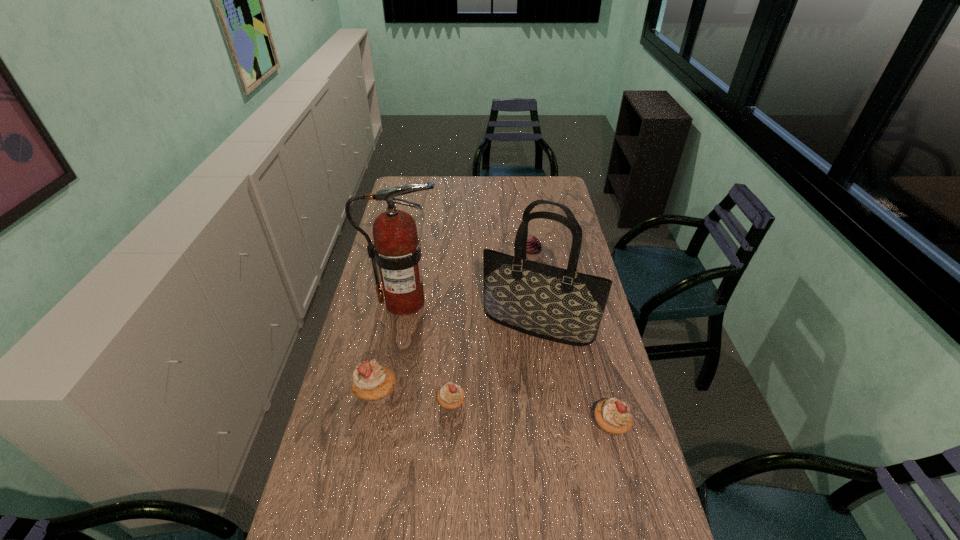
Identify the location of free spot at the left edge of the desktop. (375, 305).

Find the location of a particular element. Image resolution: width=960 pixels, height=540 pixels. free space at the right edge is located at coordinates (627, 443).

Find the location of a particular element. The image size is (960, 540). vacant space at the far left corner of the desktop is located at coordinates (425, 177).

In order to click on vacant space at the near right corner of the desktop in this screenshot , I will do `click(647, 514)`.

The width and height of the screenshot is (960, 540). I want to click on vacant area between the third cupcake from right to left and the fire extinguisher, so click(x=428, y=353).

Image resolution: width=960 pixels, height=540 pixels. In order to click on free space between the fire extinguisher and the fourth object from right to left in this screenshot , I will do `click(428, 353)`.

You are a GUI agent. You are given a task and a screenshot of the screen. Output one action in this format:
    pyautogui.click(x=<x>, y=<y>)
    Task: Click on the free space between the third cupcake from right to left and the tote bag
    This screenshot has width=960, height=540.
    Given the screenshot: What is the action you would take?
    pyautogui.click(x=494, y=364)

Locate an element on the screen. The width and height of the screenshot is (960, 540). vacant area that lies between the farthest object and the second cupcake from left to right is located at coordinates (492, 330).

This screenshot has height=540, width=960. In order to click on vacant region between the farthest object and the third cupcake from right to left in this screenshot , I will do `click(492, 330)`.

Identify the location of vacant area that lies between the second cupcake from left to right and the tote bag. Image resolution: width=960 pixels, height=540 pixels. (494, 364).